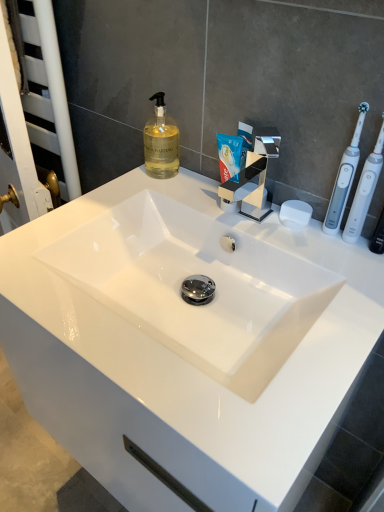
The width and height of the screenshot is (384, 512). I want to click on vacant space situated on the left part of white plastic toothbrush at right, positioned as the second toothbrush in left-to-right order, so [x=277, y=231].